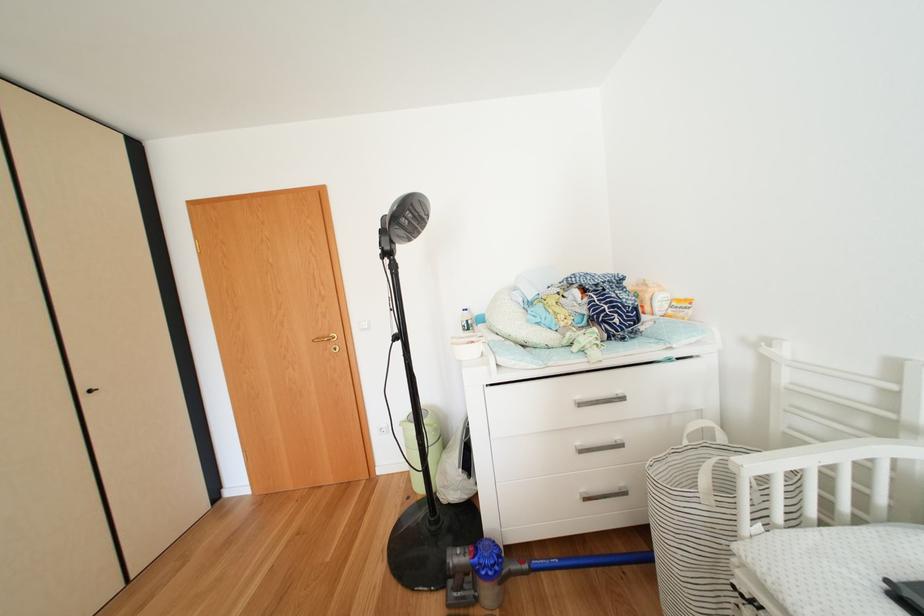
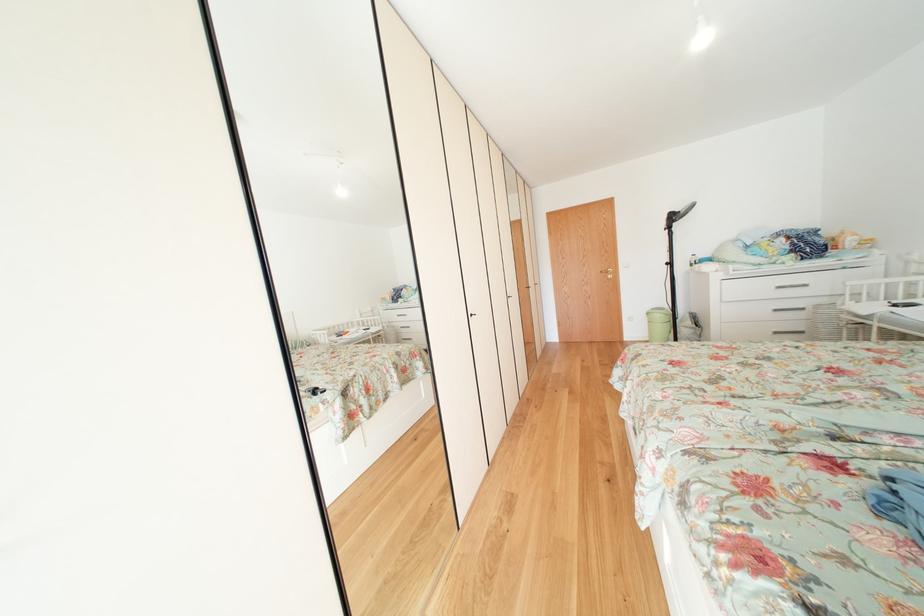
Question: I am providing you with two images of the same scene from different viewpoints. Which of the following objects are not visible in image2?

Choices:
 (A) white drawer handle
 (B) white patterned holder
 (C) gold door handle
 (D) black cabinet handle

Answer: (D)